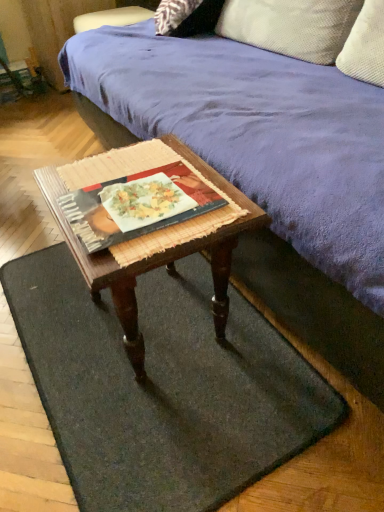
Identify the location of vacant area on top of green felt doormat at lower center (from a real-world perspective). (153, 358).